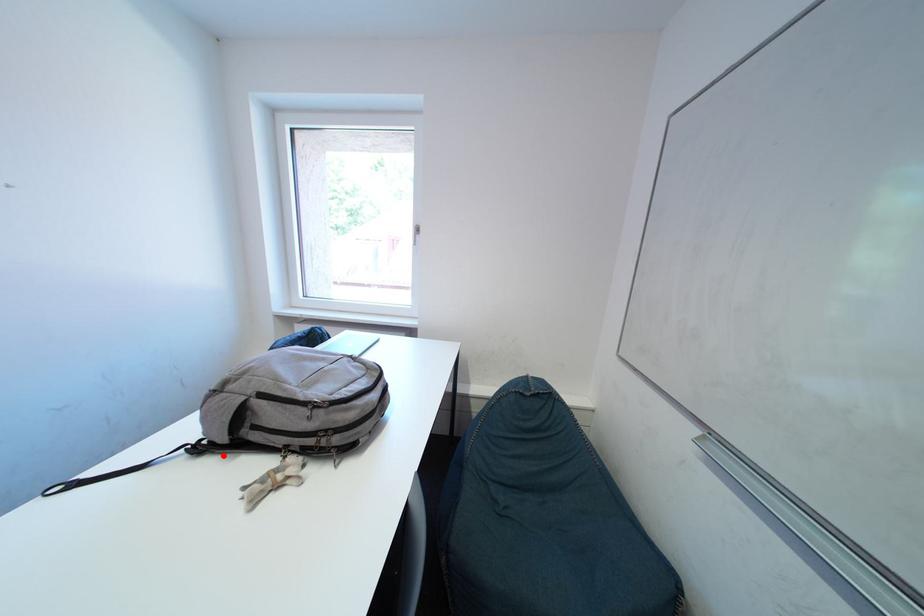
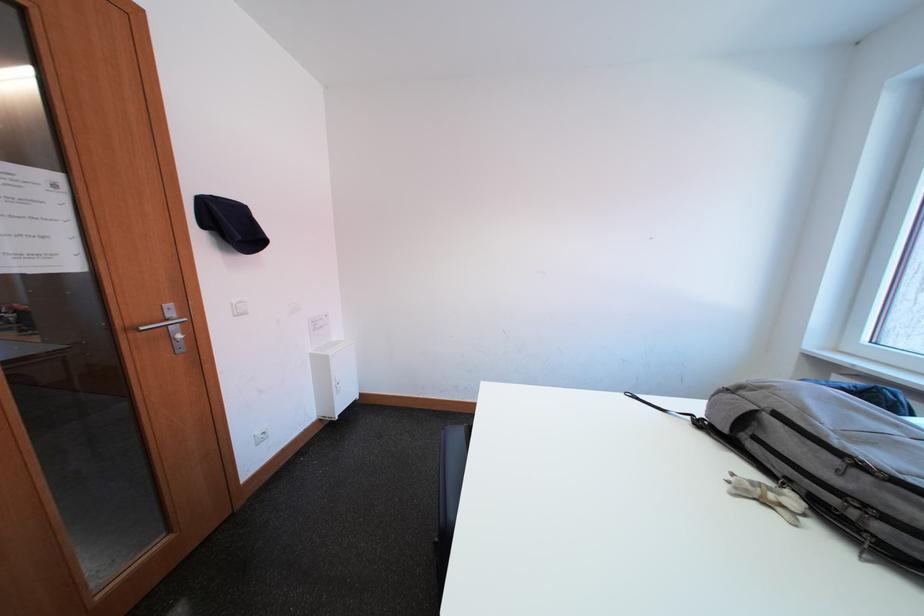
The point at the highlighted location is marked in the first image. Where is the corresponding point in the second image?

(719, 438)